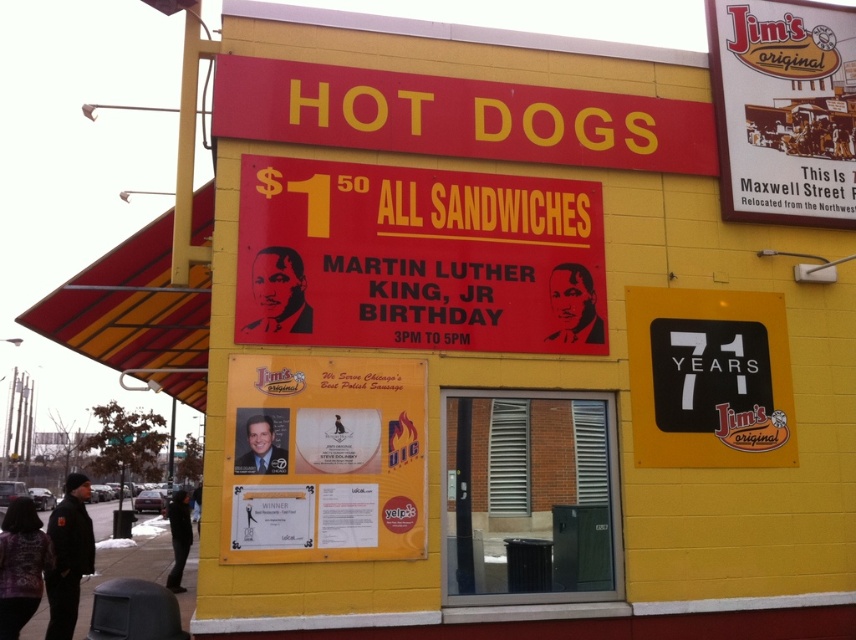
Does red matte signboard at center have a greater width compared to black plastic sign at right?

Yes, red matte signboard at center is wider than black plastic sign at right.

Which of these two, red matte signboard at center or black plastic sign at right, stands taller?

red matte signboard at center is taller.

This screenshot has height=640, width=856. In order to click on red matte signboard at center in this screenshot , I will do `click(417, 259)`.

At what (x,y) coordinates should I click in order to perform the action: click on red matte signboard at center. Please return your answer as a coordinate pair (x, y). The image size is (856, 640). Looking at the image, I should click on (417, 259).

Can you confirm if red matte signboard at center is bigger than matte white sign at upper right?

Correct, red matte signboard at center is larger in size than matte white sign at upper right.

Measure the distance between red matte signboard at center and camera.

A distance of 5.59 meters exists between red matte signboard at center and camera.

Does point (278, 312) come farther from viewer compared to point (818, 100)?

No, it is in front of (818, 100).

At what (x,y) coordinates should I click in order to perform the action: click on red matte signboard at center. Please return your answer as a coordinate pair (x, y). Looking at the image, I should click on (417, 259).

What do you see at coordinates (324, 458) in the screenshot? I see `matte yellow signboard at center` at bounding box center [324, 458].

Does matte yellow signboard at center appear on the left side of black plastic sign at right?

Indeed, matte yellow signboard at center is positioned on the left side of black plastic sign at right.

Is point (275, 381) positioned after point (749, 400)?

No, it is in front of (749, 400).

Where is `matte yellow signboard at center`? Image resolution: width=856 pixels, height=640 pixels. matte yellow signboard at center is located at coordinates (324, 458).